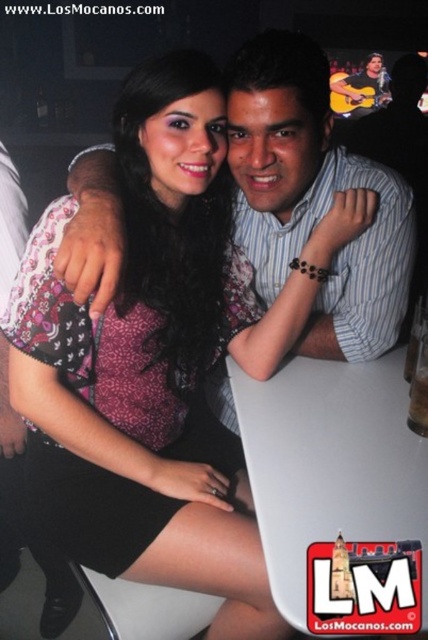
You are a photographer trying to capture a candid shot of both the matte striped shirt at center and the smooth brown guitar at upper right. Since you can only focus on one object at a time, which object should you focus on first to ensure the other remains in the frame?

You should focus on the matte striped shirt at center first because it is positioned to the left of the smooth brown guitar at upper right, so by focusing on the leftmost object, the guitar will still be in the frame to its right.

You are a photographer trying to capture the scene where the woman and man are seated at the bar. You want to focus on the point at coordinates point (312,196). According to the scene description, what object is located at that point?

The point (312,196) is on the matte striped shirt at center.

You are standing in the bar and want to place a drink order. The bartender is at the counter on the right side of the frame. You need to point to the matte striped shirt at center to indicate the person you want to order for. Where should you direct your gesture relative to the counter?

The matte striped shirt at center is located at the coordinates point (312, 196), so you should direct your gesture towards the center area near the counter to point to the person wearing the matte striped shirt at center.